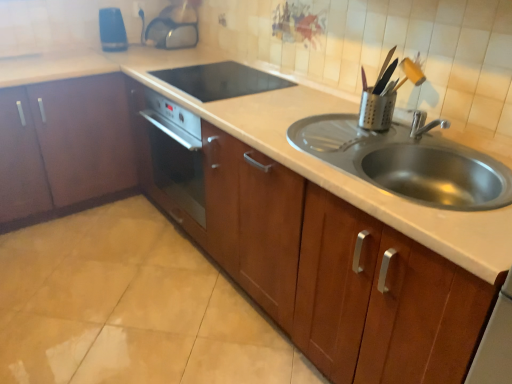
Question: Is wooden cabinet at center, which is counted as the 1th cabinetry, starting from the right, looking in the opposite direction of black glass cooktop at center, which is the 3th appliance in left-to-right order?

Choices:
 (A) yes
 (B) no

Answer: (B)

Question: Would you say black glass cooktop at center, the second appliance viewed from the front, is part of wooden cabinet at center, which is counted as the 1th cabinetry, starting from the right,'s contents?

Choices:
 (A) no
 (B) yes

Answer: (B)

Question: From a real-world perspective, is wooden cabinet at center, the 2th cabinetry positioned from the left, on top of black glass cooktop at center, which is counted as the 3th appliance, starting from the back?

Choices:
 (A) yes
 (B) no

Answer: (B)

Question: Considering the relative sizes of wooden cabinet at center, the 2th cabinetry positioned from the left, and black glass cooktop at center, which ranks as the 2th appliance in right-to-left order, in the image provided, is wooden cabinet at center, the 2th cabinetry positioned from the left, thinner than black glass cooktop at center, which ranks as the 2th appliance in right-to-left order,?

Choices:
 (A) yes
 (B) no

Answer: (B)

Question: Is wooden cabinet at center, the 2th cabinetry positioned from the left, shorter than black glass cooktop at center, which is counted as the 3th appliance, starting from the back?

Choices:
 (A) yes
 (B) no

Answer: (B)

Question: From the image's perspective, is blue plastic electric outlet at upper center positioned above or below black glass cooktop at center, which is counted as the 3th appliance, starting from the back?

Choices:
 (A) below
 (B) above

Answer: (B)

Question: Visually, is blue plastic electric outlet at upper center positioned to the left or to the right of black glass cooktop at center, the second appliance viewed from the front?

Choices:
 (A) left
 (B) right

Answer: (A)

Question: From a real-world perspective, is blue plastic electric outlet at upper center physically located above or below black glass cooktop at center, which ranks as the 2th appliance in right-to-left order?

Choices:
 (A) above
 (B) below

Answer: (A)

Question: Is point (138, 8) positioned closer to the camera than point (270, 84)?

Choices:
 (A) farther
 (B) closer

Answer: (A)

Question: Is black glass cooktop at center, the second appliance viewed from the front, bigger or smaller than blue plastic electric outlet at upper center?

Choices:
 (A) big
 (B) small

Answer: (A)

Question: Is black glass cooktop at center, which ranks as the 2th appliance in right-to-left order, wider or thinner than blue plastic electric outlet at upper center?

Choices:
 (A) wide
 (B) thin

Answer: (A)

Question: Which is correct: black glass cooktop at center, which ranks as the 2th appliance in right-to-left order, is inside blue plastic electric outlet at upper center, or outside of it?

Choices:
 (A) inside
 (B) outside

Answer: (B)

Question: From the image's perspective, relative to blue plastic electric outlet at upper center, is black glass cooktop at center, which is counted as the 3th appliance, starting from the back, above or below?

Choices:
 (A) above
 (B) below

Answer: (B)

Question: Choose the correct answer: Is blue plastic electric outlet at upper center inside transparent plastic kettle at upper center, the third appliance viewed from the right, or outside it?

Choices:
 (A) outside
 (B) inside

Answer: (A)

Question: Considering the positions of point (133, 3) and point (157, 44), is point (133, 3) closer or farther from the camera than point (157, 44)?

Choices:
 (A) closer
 (B) farther

Answer: (B)